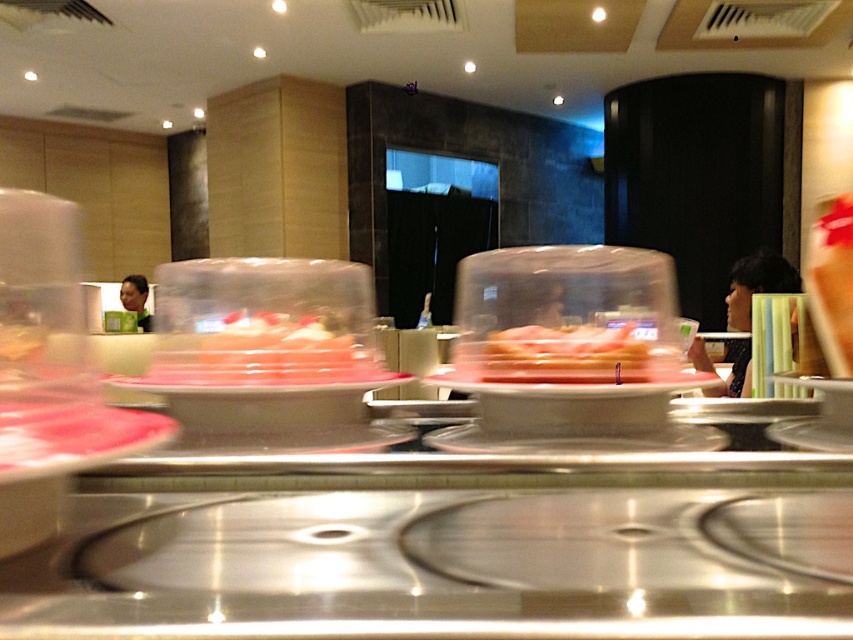
Which of these two, pink translucent sushi at center or clear plastic plate at center, stands taller?

pink translucent sushi at center is taller.

Is pink translucent sushi at center to the right of clear plastic plate at center from the viewer's perspective?

In fact, pink translucent sushi at center is to the left of clear plastic plate at center.

Which is in front, point (219, 346) or point (671, 451)?

Point (671, 451)

Find the location of a particular element. This screenshot has height=640, width=853. pink translucent sushi at center is located at coordinates (268, 352).

Is pink translucent plastic at center above clear plastic plate at center?

Indeed, pink translucent plastic at center is positioned over clear plastic plate at center.

What do you see at coordinates (566, 349) in the screenshot?
I see `pink translucent plastic at center` at bounding box center [566, 349].

Describe the element at coordinates (566, 349) in the screenshot. I see `pink translucent plastic at center` at that location.

Identify the location of pink translucent plastic at center. (566, 349).

Measure the distance between pink translucent sushi at center and camera.

A distance of 2.80 meters exists between pink translucent sushi at center and camera.

This screenshot has width=853, height=640. What do you see at coordinates (268, 352) in the screenshot?
I see `pink translucent sushi at center` at bounding box center [268, 352].

You are a GUI agent. You are given a task and a screenshot of the screen. Output one action in this format:
    pyautogui.click(x=<x>, y=<y>)
    Task: Click on the pink translucent sushi at center
    Image resolution: width=853 pixels, height=640 pixels.
    Given the screenshot: What is the action you would take?
    pyautogui.click(x=268, y=352)